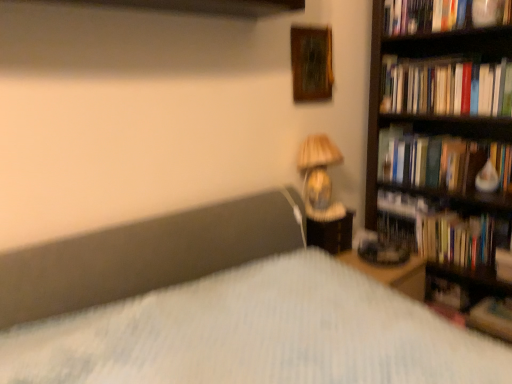
Where is `free space above hardcover book at right, positioned as the 1th book in bottom-to-top order (from a real-world perspective)`? The image size is (512, 384). free space above hardcover book at right, positioned as the 1th book in bottom-to-top order (from a real-world perspective) is located at coordinates (500, 303).